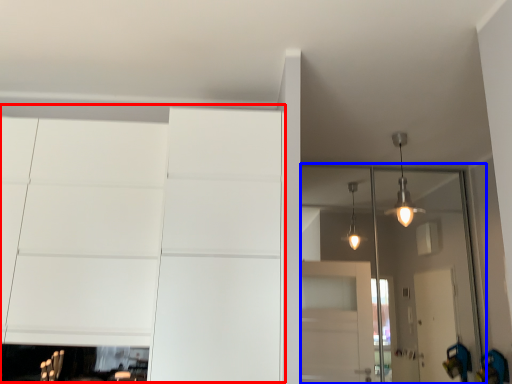
Question: Which of the following is the farthest to the observer, dresser (highlighted by a red box) or glass door (highlighted by a blue box)?

Choices:
 (A) dresser
 (B) glass door

Answer: (B)